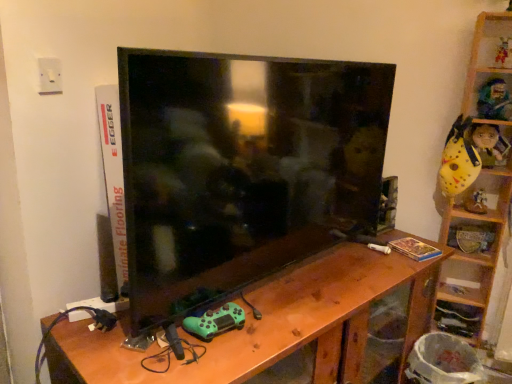
Where is `vacant area to the right of green matte controller at lower center, the fifth toy when ordered from back to front`? Image resolution: width=512 pixels, height=384 pixels. vacant area to the right of green matte controller at lower center, the fifth toy when ordered from back to front is located at coordinates (274, 325).